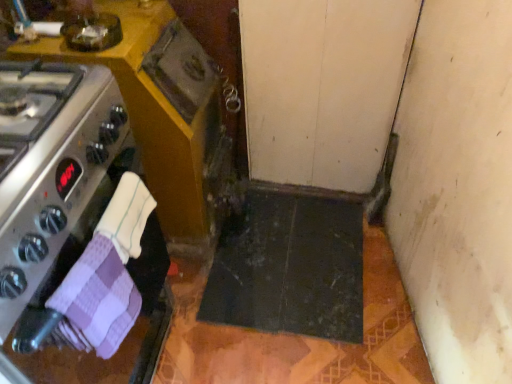
Question: Looking at the image, does matte wood cabinet at lower center seem bigger or smaller compared to purple checkered cloth at left, which ranks as the 1th hand towel in bottom-to-top order?

Choices:
 (A) big
 (B) small

Answer: (A)

Question: Relative to purple checkered cloth at left, arranged as the 2th hand towel when viewed from the top, is matte wood cabinet at lower center in front or behind?

Choices:
 (A) front
 (B) behind

Answer: (B)

Question: Estimate the real-world distances between objects in this image. Which object is closer to the white textured hand towel at lower left, the 1th hand towel from the top?

Choices:
 (A) satin silver oven at left
 (B) matte wood cabinet at lower center
 (C) purple checkered cloth at left, which ranks as the 1th hand towel in bottom-to-top order

Answer: (C)

Question: Estimate the real-world distances between objects in this image. Which object is closer to the satin silver oven at left?

Choices:
 (A) matte wood cabinet at lower center
 (B) white textured hand towel at lower left, which appears as the 2th hand towel when ordered from the bottom
 (C) purple checkered cloth at left, arranged as the 2th hand towel when viewed from the top

Answer: (C)